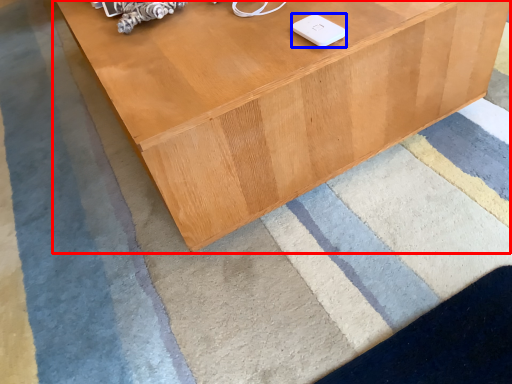
Question: Which object appears closest to the camera in this image, table (highlighted by a red box) or ipod (highlighted by a blue box)?

Choices:
 (A) table
 (B) ipod

Answer: (A)